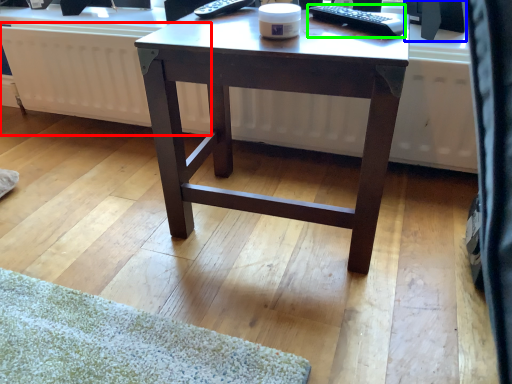
Question: Based on their relative distances, which object is nearer to radiator (highlighted by a red box)? Choose from computer monitor (highlighted by a blue box) and remote control (highlighted by a green box).

Choices:
 (A) computer monitor
 (B) remote control

Answer: (B)